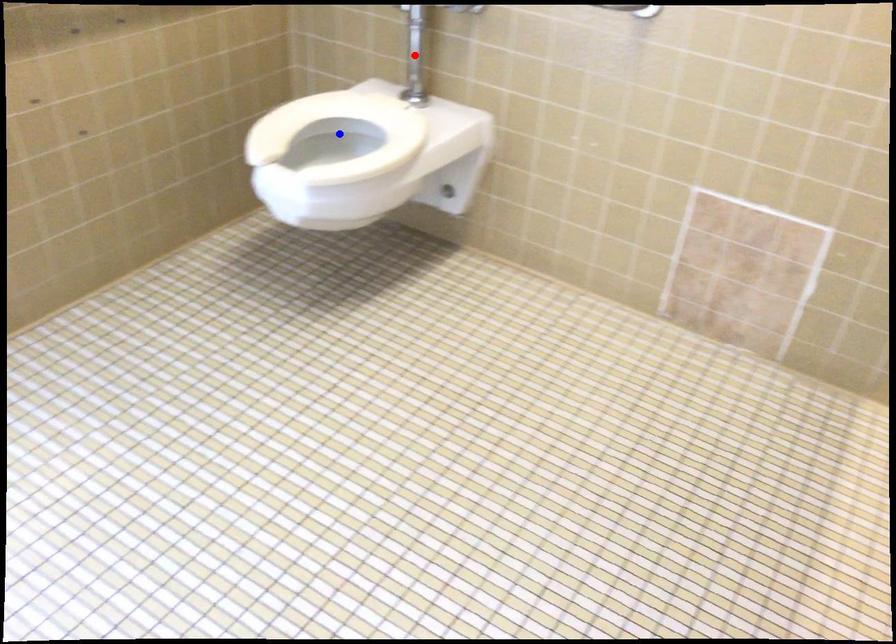
Question: Which of the two points in the image is closer to the camera?

Choices:
 (A) Blue point is closer.
 (B) Red point is closer.

Answer: (A)